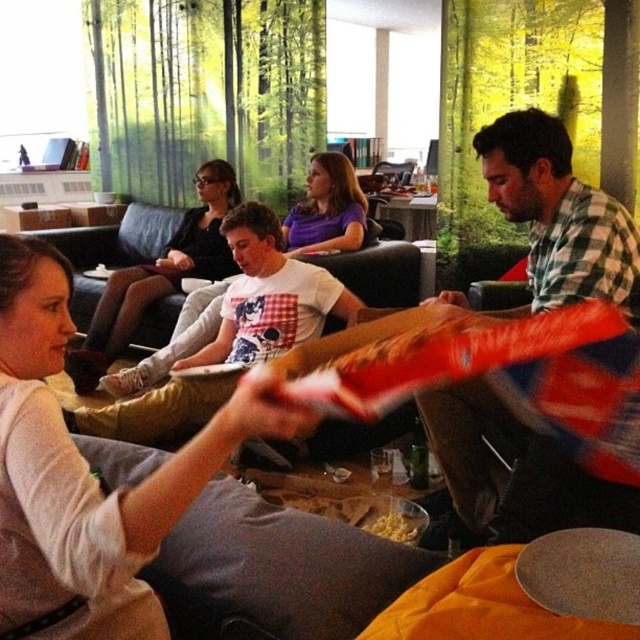
Based on the photo, is checkered fabric shirt at right smaller than purple matte shirt at center?

Correct, checkered fabric shirt at right occupies less space than purple matte shirt at center.

The height and width of the screenshot is (640, 640). What do you see at coordinates (557, 216) in the screenshot?
I see `checkered fabric shirt at right` at bounding box center [557, 216].

Is point (541, 500) less distant than point (308, 218)?

That is True.

Where is `checkered fabric shirt at right`? This screenshot has height=640, width=640. checkered fabric shirt at right is located at coordinates (557, 216).

Does white matte shirt at upper left have a lesser height compared to matte black shirt at center?

Yes.

Can you confirm if white matte shirt at upper left is taller than matte black shirt at center?

No.

Locate an element on the screen. The width and height of the screenshot is (640, 640). white matte shirt at upper left is located at coordinates (84, 476).

Does checkered fabric shirt at right have a smaller size compared to matte black shirt at center?

Indeed, checkered fabric shirt at right has a smaller size compared to matte black shirt at center.

Which is below, checkered fabric shirt at right or matte black shirt at center?

matte black shirt at center is below.

This screenshot has width=640, height=640. In order to click on checkered fabric shirt at right in this screenshot , I will do `click(557, 216)`.

Image resolution: width=640 pixels, height=640 pixels. Identify the location of checkered fabric shirt at right. (557, 216).